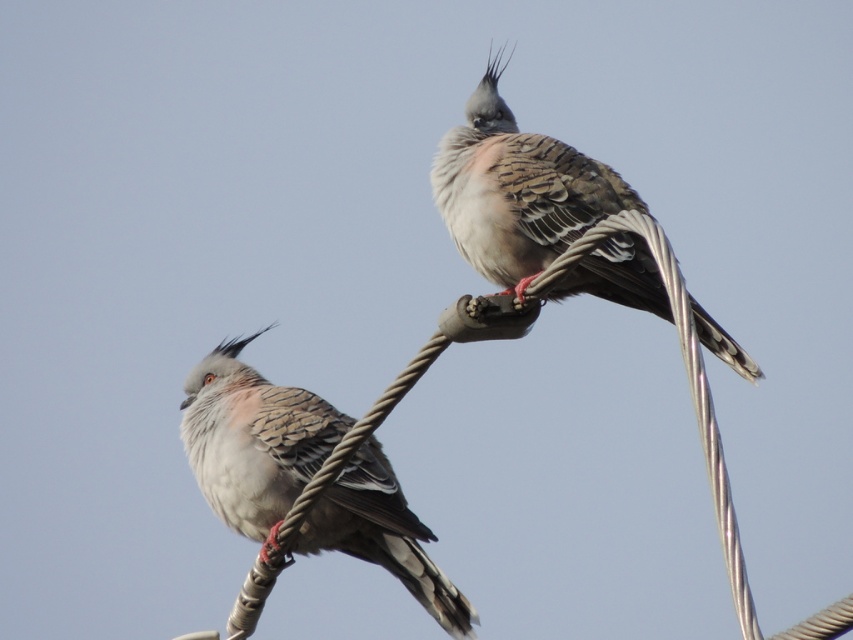
Question: Which point appears farthest from the camera in this image?

Choices:
 (A) (223, 406)
 (B) (544, 264)

Answer: (A)

Question: Does speckled feathered pigeon at lower left appear under speckled feathered bird at upper right?

Choices:
 (A) no
 (B) yes

Answer: (B)

Question: Which point is closer to the camera?

Choices:
 (A) speckled feathered pigeon at lower left
 (B) speckled feathered bird at upper right

Answer: (B)

Question: Does speckled feathered pigeon at lower left appear on the left side of speckled feathered bird at upper right?

Choices:
 (A) no
 (B) yes

Answer: (B)

Question: Is speckled feathered pigeon at lower left to the right of speckled feathered bird at upper right from the viewer's perspective?

Choices:
 (A) yes
 (B) no

Answer: (B)